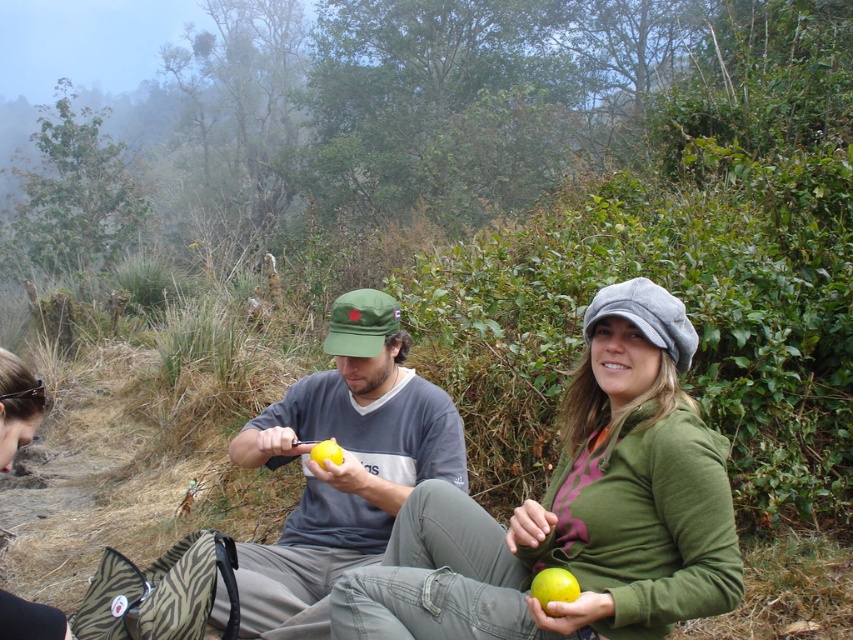
Question: Considering the relative positions of matte black hair at lower left and yellow matte apple at center in the image provided, where is matte black hair at lower left located with respect to yellow matte apple at center?

Choices:
 (A) below
 (B) above

Answer: (B)

Question: Which of these objects is positioned closest to the matte black hair at lower left?

Choices:
 (A) yellow matte apple at center
 (B) matte gray cap at center

Answer: (A)

Question: Does matte gray cap at center appear on the right side of yellow matte apple at center?

Choices:
 (A) no
 (B) yes

Answer: (B)

Question: Among these points, which one is farthest from the camera?

Choices:
 (A) (706, 444)
 (B) (422, 428)
 (C) (22, 400)
 (D) (575, 596)

Answer: (B)

Question: Which object is positioned closest to the matte black hair at lower left?

Choices:
 (A) matte green sweater at center
 (B) yellow matte apple at center
 (C) yellow matte apple at lower center

Answer: (B)

Question: Is the position of matte gray cap at center less distant than that of yellow matte apple at center?

Choices:
 (A) yes
 (B) no

Answer: (A)